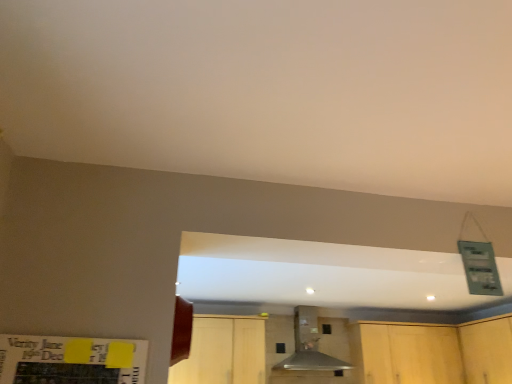
Find the location of a particular element. The image size is (512, 384). light wood cabinet at lower center, which is the 1th cabinetry in left-to-right order is located at coordinates (223, 352).

Describe the element at coordinates (487, 351) in the screenshot. I see `wooden cabinet at lower right, the 1th cabinetry in the right-to-left sequence` at that location.

Find the location of a particular element. The image size is (512, 384). metallic gray vent at center is located at coordinates (309, 345).

Where is `light wood cabinet at lower center, which ranks as the 3th cabinetry in right-to-left order`? This screenshot has width=512, height=384. light wood cabinet at lower center, which ranks as the 3th cabinetry in right-to-left order is located at coordinates (223, 352).

Considering the positions of point (477, 339) and point (316, 342), is point (477, 339) closer or farther from the camera than point (316, 342)?

Point (477, 339) appears to be closer to the viewer than point (316, 342).

From a real-world perspective, relative to metallic gray vent at center, is wooden cabinet at lower right, which ranks as the 3th cabinetry in left-to-right order, vertically above or below?

wooden cabinet at lower right, which ranks as the 3th cabinetry in left-to-right order, is below metallic gray vent at center.

Measure the distance from wooden cabinet at lower right, the 1th cabinetry in the right-to-left sequence, to metallic gray vent at center.

wooden cabinet at lower right, the 1th cabinetry in the right-to-left sequence, is 1.44 meters away from metallic gray vent at center.

Between wooden cabinet at lower right, the 1th cabinetry in the right-to-left sequence, and metallic gray vent at center, which one is positioned in front?

Positioned in front is wooden cabinet at lower right, the 1th cabinetry in the right-to-left sequence.

Could you tell me if wooden cabinet at lower right, the 1th cabinetry in the right-to-left sequence, is turned towards light wood cabinetry at lower right, the second cabinetry viewed from the right?

Yes, wooden cabinet at lower right, the 1th cabinetry in the right-to-left sequence, is oriented towards light wood cabinetry at lower right, the second cabinetry viewed from the right.

In the scene shown: From the image's perspective, is wooden cabinet at lower right, which ranks as the 3th cabinetry in left-to-right order, above or below light wood cabinetry at lower right, the second cabinetry viewed from the right?

Clearly, from the image's perspective, wooden cabinet at lower right, which ranks as the 3th cabinetry in left-to-right order, is above light wood cabinetry at lower right, the second cabinetry viewed from the right.

Considering the relative sizes of wooden cabinet at lower right, the 1th cabinetry in the right-to-left sequence, and light wood cabinetry at lower right, arranged as the 2th cabinetry when viewed from the left, in the image provided, is wooden cabinet at lower right, the 1th cabinetry in the right-to-left sequence, thinner than light wood cabinetry at lower right, arranged as the 2th cabinetry when viewed from the left,?

Yes, wooden cabinet at lower right, the 1th cabinetry in the right-to-left sequence, is thinner than light wood cabinetry at lower right, arranged as the 2th cabinetry when viewed from the left.

Considering their positions, is wooden cabinet at lower right, which ranks as the 3th cabinetry in left-to-right order, located in front of or behind light wood cabinetry at lower right, the second cabinetry viewed from the right?

Visually, wooden cabinet at lower right, which ranks as the 3th cabinetry in left-to-right order, is located in front of light wood cabinetry at lower right, the second cabinetry viewed from the right.

Which is closer to the camera, (381,378) or (212,382)?

Point (381,378) appears to be farther away from the viewer than point (212,382).

From the image's perspective, which one is positioned lower, light wood cabinetry at lower right, the second cabinetry viewed from the right, or light wood cabinet at lower center, which ranks as the 3th cabinetry in right-to-left order?

light wood cabinetry at lower right, the second cabinetry viewed from the right, appears lower in the image.

Which of these two, light wood cabinetry at lower right, the second cabinetry viewed from the right, or light wood cabinet at lower center, which is the 1th cabinetry in left-to-right order, stands shorter?

With less height is light wood cabinet at lower center, which is the 1th cabinetry in left-to-right order.

Identify the location of the 2nd cabinetry above the light wood cabinetry at lower right, arranged as the 2th cabinetry when viewed from the left (from the image's perspective). (223, 352).

Between light wood cabinet at lower center, which ranks as the 3th cabinetry in right-to-left order, and light wood cabinetry at lower right, arranged as the 2th cabinetry when viewed from the left, which one has smaller width?

light wood cabinet at lower center, which ranks as the 3th cabinetry in right-to-left order.

Based on the photo, is there a large distance between light wood cabinet at lower center, which ranks as the 3th cabinetry in right-to-left order, and light wood cabinetry at lower right, the second cabinetry viewed from the right?

Absolutely, light wood cabinet at lower center, which ranks as the 3th cabinetry in right-to-left order, is distant from light wood cabinetry at lower right, the second cabinetry viewed from the right.

From the image's perspective, does light wood cabinet at lower center, which ranks as the 3th cabinetry in right-to-left order, appear lower than light wood cabinetry at lower right, arranged as the 2th cabinetry when viewed from the left?

Incorrect, from the image's perspective, light wood cabinet at lower center, which ranks as the 3th cabinetry in right-to-left order, is higher than light wood cabinetry at lower right, arranged as the 2th cabinetry when viewed from the left.

Which object is closer to the camera, light wood cabinet at lower center, which ranks as the 3th cabinetry in right-to-left order, or light wood cabinetry at lower right, arranged as the 2th cabinetry when viewed from the left?

light wood cabinet at lower center, which ranks as the 3th cabinetry in right-to-left order, is more forward.

Which is more to the right, metallic gray vent at center or wooden cabinet at lower right, which ranks as the 3th cabinetry in left-to-right order?

Positioned to the right is wooden cabinet at lower right, which ranks as the 3th cabinetry in left-to-right order.

Does point (288, 366) come farther from viewer compared to point (463, 327)?

No.

What are the coordinates of `vent on the left of the wooden cabinet at lower right, the 1th cabinetry in the right-to-left sequence` in the screenshot? It's located at (309, 345).

Are metallic gray vent at center and wooden cabinet at lower right, the 1th cabinetry in the right-to-left sequence, far apart?

Yes, metallic gray vent at center is far from wooden cabinet at lower right, the 1th cabinetry in the right-to-left sequence.

In terms of size, does metallic gray vent at center appear bigger or smaller than light wood cabinetry at lower right, the second cabinetry viewed from the right?

Answer: Considering their sizes, metallic gray vent at center takes up less space than light wood cabinetry at lower right, the second cabinetry viewed from the right.

From the image's perspective, is metallic gray vent at center located above light wood cabinetry at lower right, the second cabinetry viewed from the right?

Yes.

Looking at this image, would you say metallic gray vent at center contains light wood cabinetry at lower right, arranged as the 2th cabinetry when viewed from the left?

No, metallic gray vent at center does not contain light wood cabinetry at lower right, arranged as the 2th cabinetry when viewed from the left.

Looking at this image, considering their positions, is metallic gray vent at center located in front of or behind light wood cabinet at lower center, which is the 1th cabinetry in left-to-right order?

Visually, metallic gray vent at center is located behind light wood cabinet at lower center, which is the 1th cabinetry in left-to-right order.

From a real-world perspective, which object stands above the other?

From a 3D spatial view, metallic gray vent at center is above.

Is metallic gray vent at center positioned with its back to light wood cabinet at lower center, which ranks as the 3th cabinetry in right-to-left order?

metallic gray vent at center does not have its back to light wood cabinet at lower center, which ranks as the 3th cabinetry in right-to-left order.

Identify the location of the 2nd cabinetry in front of the metallic gray vent at center. (487, 351).

Find the location of `the 2nd cabinetry behind the wooden cabinet at lower right, which ranks as the 3th cabinetry in left-to-right order`. the 2nd cabinetry behind the wooden cabinet at lower right, which ranks as the 3th cabinetry in left-to-right order is located at coordinates [x=437, y=352].

Which object lies nearer to the anchor point light wood cabinet at lower center, which is the 1th cabinetry in left-to-right order, light wood cabinetry at lower right, the second cabinetry viewed from the right, or wooden cabinet at lower right, which ranks as the 3th cabinetry in left-to-right order?

light wood cabinetry at lower right, the second cabinetry viewed from the right, lies closer to light wood cabinet at lower center, which is the 1th cabinetry in left-to-right order, than the other object.

Which object lies further to the anchor point light wood cabinet at lower center, which ranks as the 3th cabinetry in right-to-left order, metallic gray vent at center or light wood cabinetry at lower right, the second cabinetry viewed from the right?

light wood cabinetry at lower right, the second cabinetry viewed from the right, is positioned further to the anchor light wood cabinet at lower center, which ranks as the 3th cabinetry in right-to-left order.

When comparing their distances from metallic gray vent at center, does wooden cabinet at lower right, the 1th cabinetry in the right-to-left sequence, or light wood cabinet at lower center, which is the 1th cabinetry in left-to-right order, seem closer?

light wood cabinet at lower center, which is the 1th cabinetry in left-to-right order, is closer to metallic gray vent at center.

When comparing their distances from light wood cabinetry at lower right, arranged as the 2th cabinetry when viewed from the left, does wooden cabinet at lower right, which ranks as the 3th cabinetry in left-to-right order, or light wood cabinet at lower center, which is the 1th cabinetry in left-to-right order, seem closer?

wooden cabinet at lower right, which ranks as the 3th cabinetry in left-to-right order, lies closer to light wood cabinetry at lower right, arranged as the 2th cabinetry when viewed from the left, than the other object.

From the image, which object appears to be farther from wooden cabinet at lower right, which ranks as the 3th cabinetry in left-to-right order, light wood cabinetry at lower right, arranged as the 2th cabinetry when viewed from the left, or light wood cabinet at lower center, which is the 1th cabinetry in left-to-right order?

light wood cabinet at lower center, which is the 1th cabinetry in left-to-right order, is positioned further to the anchor wooden cabinet at lower right, which ranks as the 3th cabinetry in left-to-right order.

Based on the photo, when comparing their distances from wooden cabinet at lower right, the 1th cabinetry in the right-to-left sequence, does metallic gray vent at center or light wood cabinetry at lower right, the second cabinetry viewed from the right, seem closer?

Among the two, light wood cabinetry at lower right, the second cabinetry viewed from the right, is located nearer to wooden cabinet at lower right, the 1th cabinetry in the right-to-left sequence.

Which object lies nearer to the anchor point metallic gray vent at center, light wood cabinet at lower center, which is the 1th cabinetry in left-to-right order, or light wood cabinetry at lower right, arranged as the 2th cabinetry when viewed from the left?

The object closer to metallic gray vent at center is light wood cabinet at lower center, which is the 1th cabinetry in left-to-right order.

From the image, which object appears to be nearer to metallic gray vent at center, light wood cabinetry at lower right, the second cabinetry viewed from the right, or light wood cabinet at lower center, which is the 1th cabinetry in left-to-right order?

Among the two, light wood cabinet at lower center, which is the 1th cabinetry in left-to-right order, is located nearer to metallic gray vent at center.

Find the location of a particular element. The height and width of the screenshot is (384, 512). cabinetry situated between light wood cabinet at lower center, which ranks as the 3th cabinetry in right-to-left order, and wooden cabinet at lower right, which ranks as the 3th cabinetry in left-to-right order, from left to right is located at coordinates (437, 352).

The height and width of the screenshot is (384, 512). I want to click on cabinetry between metallic gray vent at center and wooden cabinet at lower right, which ranks as the 3th cabinetry in left-to-right order, so click(x=437, y=352).

The width and height of the screenshot is (512, 384). What are the coordinates of `vent situated between light wood cabinet at lower center, which ranks as the 3th cabinetry in right-to-left order, and wooden cabinet at lower right, the 1th cabinetry in the right-to-left sequence, from left to right` in the screenshot? It's located at (309, 345).

Find the location of `vent between light wood cabinet at lower center, which is the 1th cabinetry in left-to-right order, and light wood cabinetry at lower right, the second cabinetry viewed from the right`. vent between light wood cabinet at lower center, which is the 1th cabinetry in left-to-right order, and light wood cabinetry at lower right, the second cabinetry viewed from the right is located at coordinates (309, 345).